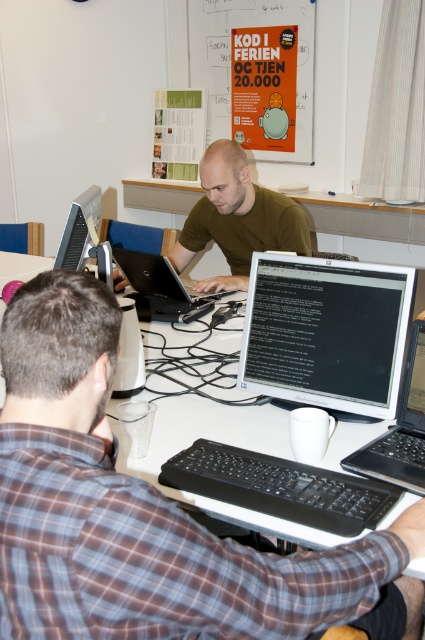
You are organizing a tech event and need to stack the black glossy laptop at center and the black matte laptop at center vertically. Which one should you place at the bottom to ensure stability?

The black glossy laptop at center is taller than the black matte laptop at center, so placing the taller glossy laptop at the bottom would provide a more stable base for stacking.

You are organizing a desk and need to place the brown plaid shirt at center and the black glossy laptop at center. Given their sizes, which item should you place first to ensure both fit properly?

The brown plaid shirt at center is larger than the black glossy laptop at center, so you should place the brown plaid shirt at center first to ensure there is enough space for both items.

You are a remote worker trying to connect to a Wi Fi network. You see two laptops, the black glossy laptop at center and the black matte laptop at center. Which one is closer to you?

The black glossy laptop at center is closer to you because it is in front of the black matte laptop at center.